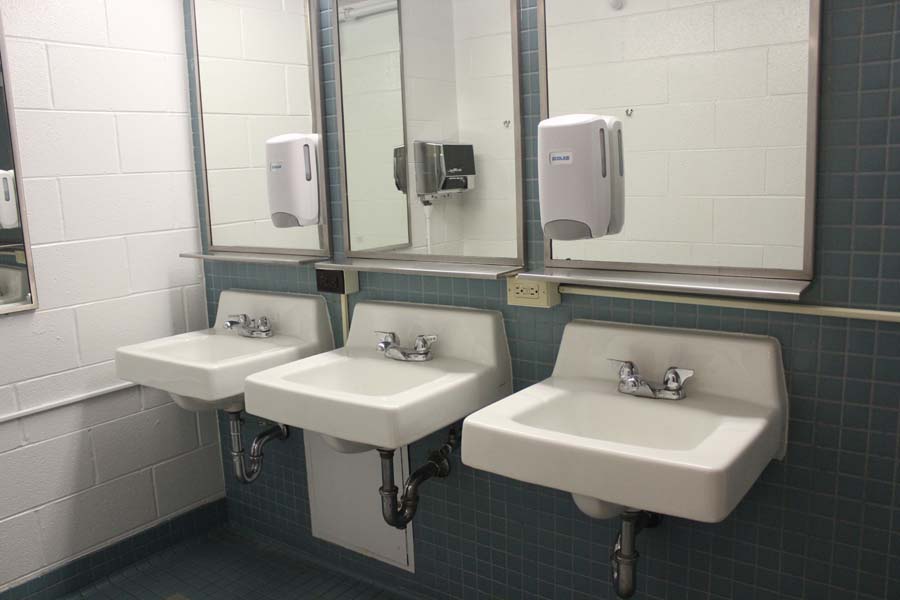
Identify the location of outlet. Image resolution: width=900 pixels, height=600 pixels. (526, 295), (327, 284).